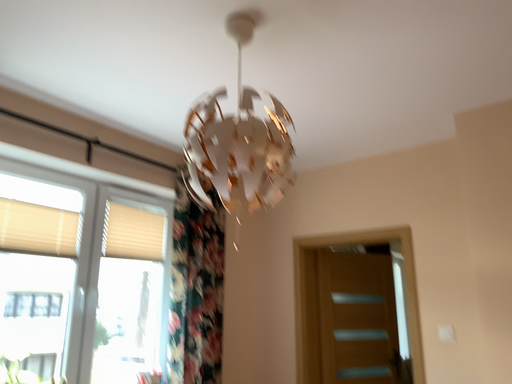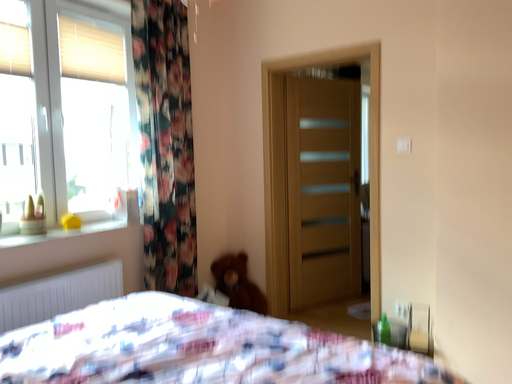
Question: How did the camera likely rotate when shooting the video?

Choices:
 (A) rotated upward
 (B) rotated downward

Answer: (B)